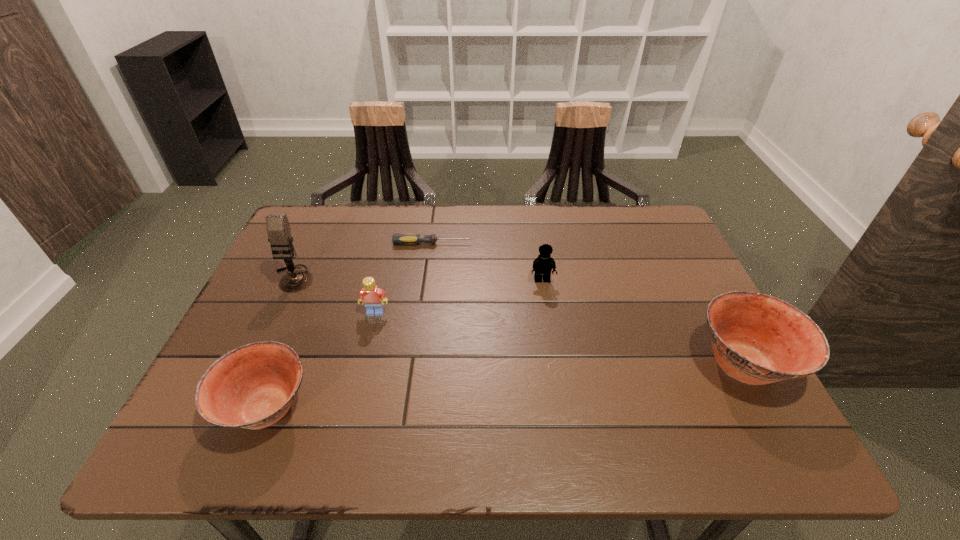
I want to click on empty location between the screwdriver and the tallest object, so click(363, 261).

You are a GUI agent. You are given a task and a screenshot of the screen. Output one action in this format:
    pyautogui.click(x=<x>, y=<y>)
    Task: Click on the empty space between the right bowl and the left bowl
    The height and width of the screenshot is (540, 960).
    Given the screenshot: What is the action you would take?
    click(506, 387)

In order to click on vacant region between the second object from right to left and the microphone in this screenshot , I will do `click(418, 279)`.

This screenshot has width=960, height=540. Find the location of `vacant region between the taller bowl and the microphone`. vacant region between the taller bowl and the microphone is located at coordinates (518, 321).

Where is `free area in between the right Lego and the nearer Lego`? This screenshot has height=540, width=960. free area in between the right Lego and the nearer Lego is located at coordinates (459, 296).

You are a GUI agent. You are given a task and a screenshot of the screen. Output one action in this format:
    pyautogui.click(x=<x>, y=<y>)
    Task: Click on the vacant area that lies between the taller bowl and the left bowl
    This screenshot has width=960, height=540.
    Given the screenshot: What is the action you would take?
    pyautogui.click(x=506, y=387)

Identify the location of the third closest object to the shortest object. (373, 297).

Choose which object is the nearest neighbor to the left bowl. Please provide its 2D coordinates. Your answer should be formatted as a tuple, i.e. [(x, y)], where the tuple contains the x and y coordinates of a point satisfying the conditions above.

[(373, 297)]

Where is `vacant space that satisfies the following two spatial constraints: 1. insert the farthest object into a screw head; 2. on the right side of the right bowl`? The image size is (960, 540). vacant space that satisfies the following two spatial constraints: 1. insert the farthest object into a screw head; 2. on the right side of the right bowl is located at coordinates (417, 365).

This screenshot has height=540, width=960. Find the location of `vacant space that satisfies the following two spatial constraints: 1. insert the farthest object into a screw head; 2. on the front-facing side of the tallest object`. vacant space that satisfies the following two spatial constraints: 1. insert the farthest object into a screw head; 2. on the front-facing side of the tallest object is located at coordinates (428, 278).